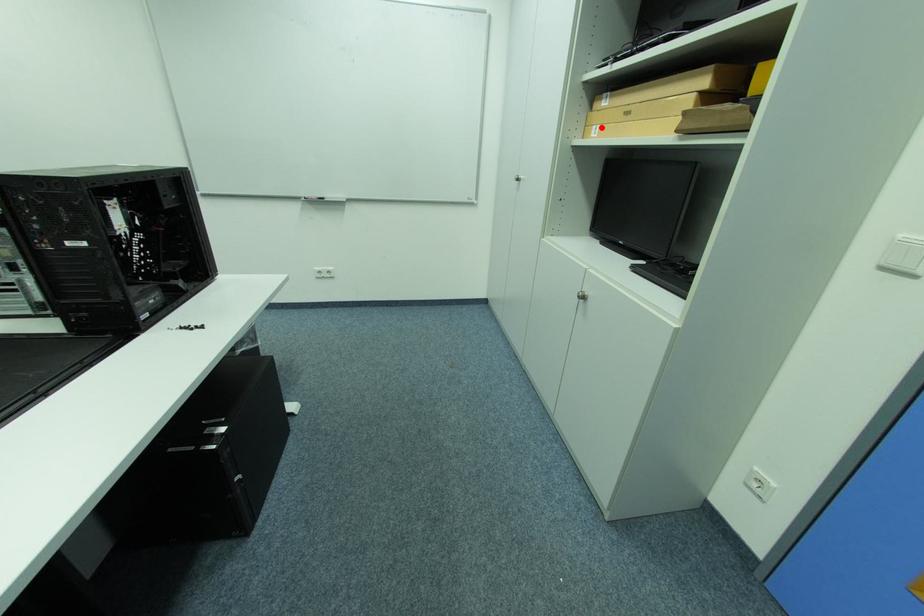
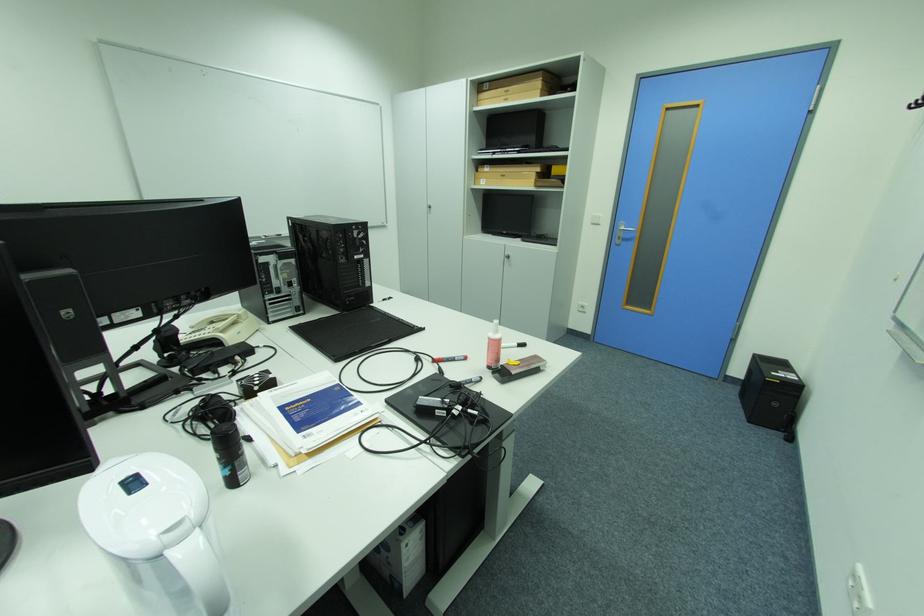
Question: I am providing you with two images of the same scene from different viewpoints. Image1 has a red point marked. In image2, the corresponding 3D location appears at what relative position? Reply with the corresponding letter.

Choices:
 (A) Closer
 (B) Farther

Answer: (A)